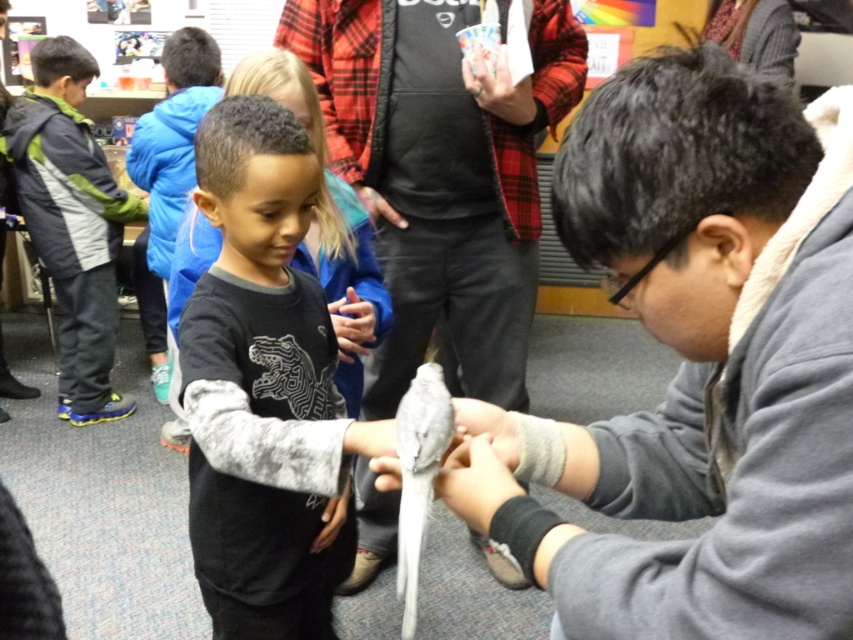
Who is lower down, gray fleece jacket at left or matte blue glove at center?

matte blue glove at center is lower down.

Is gray fleece jacket at left positioned behind matte blue glove at center?

Yes.

The image size is (853, 640). In order to click on gray fleece jacket at left in this screenshot , I will do `click(73, 221)`.

Can you confirm if flannel shirt at center is wider than matte black hand at center?

Correct, the width of flannel shirt at center exceeds that of matte black hand at center.

Which is behind, point (553, 44) or point (393, 211)?

Point (393, 211)

Image resolution: width=853 pixels, height=640 pixels. What do you see at coordinates (442, 176) in the screenshot? I see `flannel shirt at center` at bounding box center [442, 176].

You are a GUI agent. You are given a task and a screenshot of the screen. Output one action in this format:
    pyautogui.click(x=<x>, y=<y>)
    Task: Click on the flannel shirt at center
    
    Given the screenshot: What is the action you would take?
    pyautogui.click(x=442, y=176)

Is gray fleece jacket at left wider than matte black hand at center?

Indeed, gray fleece jacket at left has a greater width compared to matte black hand at center.

From the picture: Can you confirm if gray fleece jacket at left is positioned below matte black hand at center?

No, gray fleece jacket at left is not below matte black hand at center.

Does point (65, 218) come farther from viewer compared to point (389, 212)?

Yes, it is.

At what (x,y) coordinates should I click in order to perform the action: click on gray fleece jacket at left. Please return your answer as a coordinate pair (x, y). The height and width of the screenshot is (640, 853). Looking at the image, I should click on (73, 221).